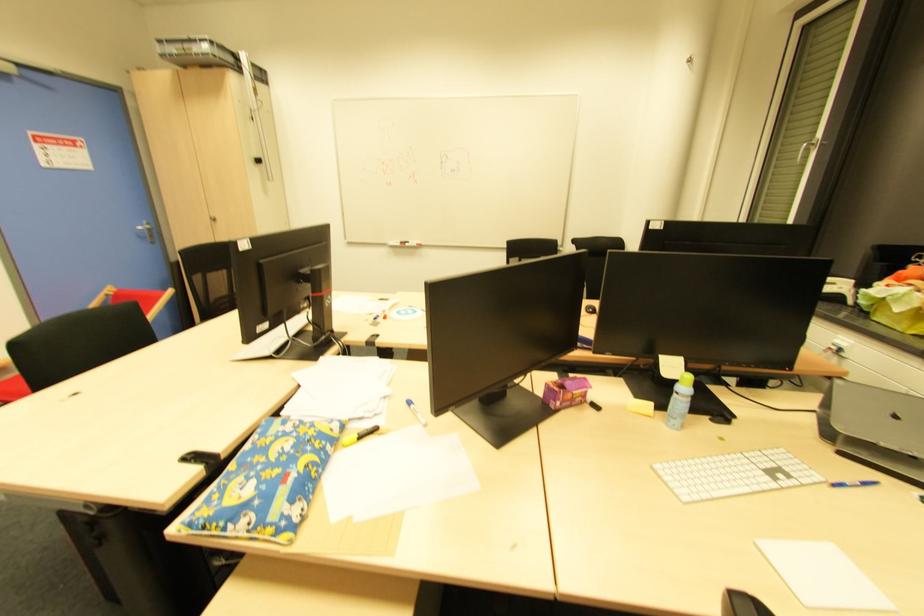
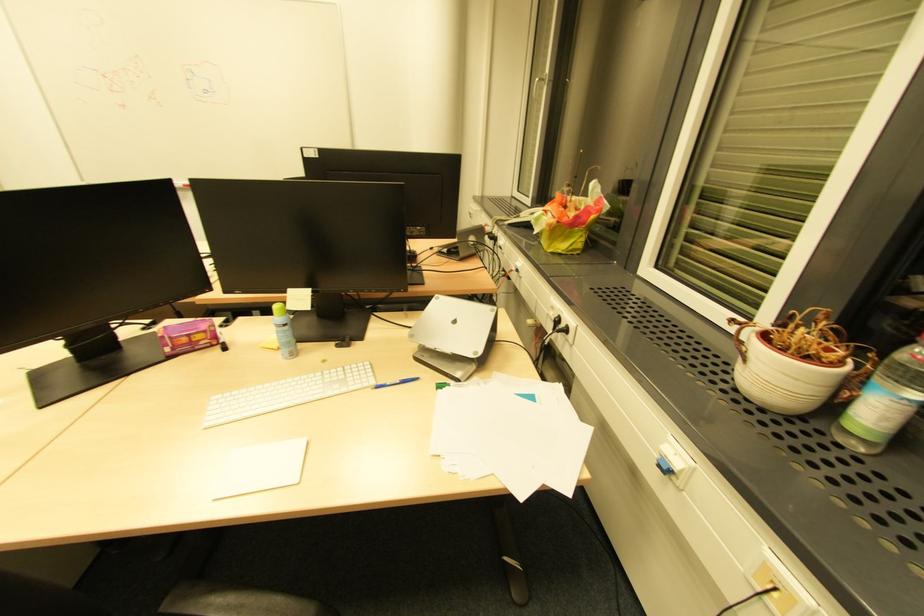
In the second image, find the point that corresponds to (x=821, y=479) in the first image.

(373, 384)